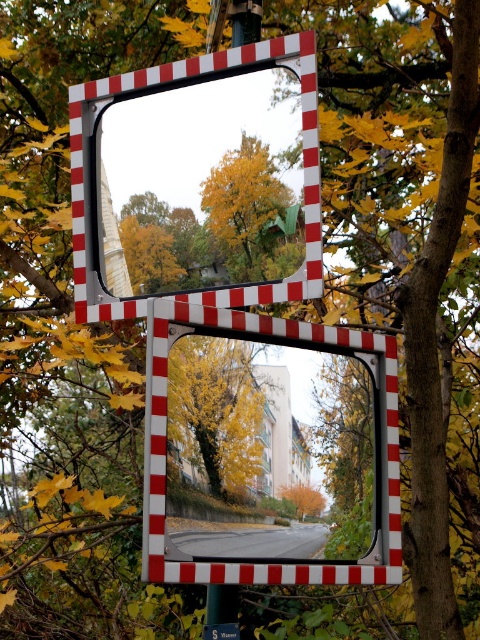
You are a delivery driver needing to check the traffic mirror to see if the road ahead is clear. The reflective glass mirror at center and the green plastic sign at lower center are in your view. Which object is wider?

The reflective glass mirror at center is wider than the green plastic sign at lower center.

What are the exact coordinates of the reflective glass mirror at center in the image?

The reflective glass mirror at center is located at point (166, 440).

You are a delivery person standing in front of the reflective glass mirror at center. You need to check if your delivery van, which is 2.5 meters long, can fit through the gap between the mirror and the nearest tree trunk visible in the mirror. Can you determine if there is enough space?

The distance between the reflective glass mirror at center and the viewer is 2.23 meters. Since the van is 2.5 meters long, it is longer than the available space, so it cannot fit through the gap.